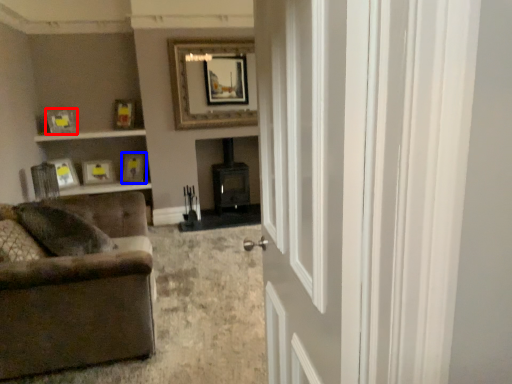
Question: Which object appears farthest to the camera in this image, picture frame (highlighted by a red box) or picture frame (highlighted by a blue box)?

Choices:
 (A) picture frame
 (B) picture frame

Answer: (B)